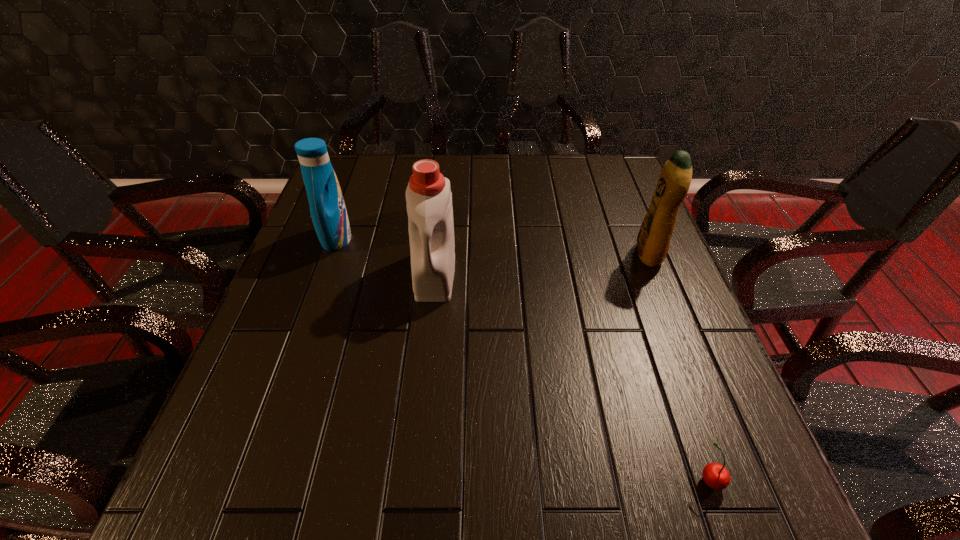
Locate an element on the screen. The width and height of the screenshot is (960, 540). the second object from left to right is located at coordinates (428, 195).

Locate an element on the screen. Image resolution: width=960 pixels, height=540 pixels. the rightmost detergent is located at coordinates (653, 240).

This screenshot has height=540, width=960. Find the location of `the leftmost object`. the leftmost object is located at coordinates (328, 211).

The image size is (960, 540). What are the coordinates of `the nearest object` in the screenshot? It's located at [715, 475].

At what (x,y) coordinates should I click in order to perform the action: click on the shortest object. Please return your answer as a coordinate pair (x, y). The height and width of the screenshot is (540, 960). Looking at the image, I should click on (715, 475).

Find the location of a particular element. The height and width of the screenshot is (540, 960). vacant point located on the handle side of the third object from right to left is located at coordinates (430, 328).

Find the location of `free space located 0.250m on the label of the rightmost detergent`. free space located 0.250m on the label of the rightmost detergent is located at coordinates (537, 254).

In order to click on free point located 0.060m on the label of the rightmost detergent in this screenshot , I will do `click(612, 254)`.

Find the location of a particular element. This screenshot has height=540, width=960. free space located on the label of the rightmost detergent is located at coordinates (592, 254).

You are a GUI agent. You are given a task and a screenshot of the screen. Output one action in this format:
    pyautogui.click(x=<x>, y=<y>)
    Task: Click on the vacant space situated 0.230m on the front-facing side of the leftmost object
    This screenshot has height=540, width=960.
    Given the screenshot: What is the action you would take?
    pyautogui.click(x=439, y=239)